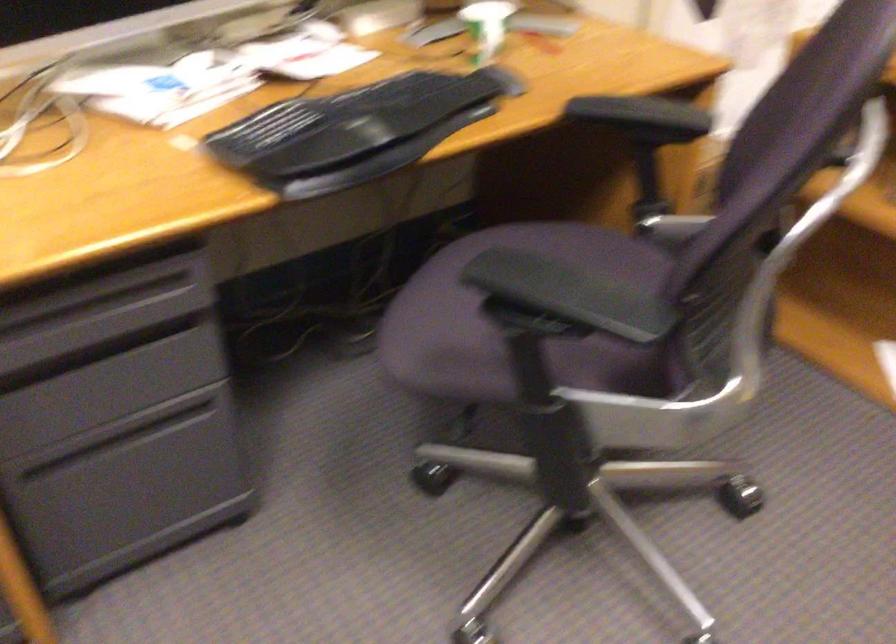
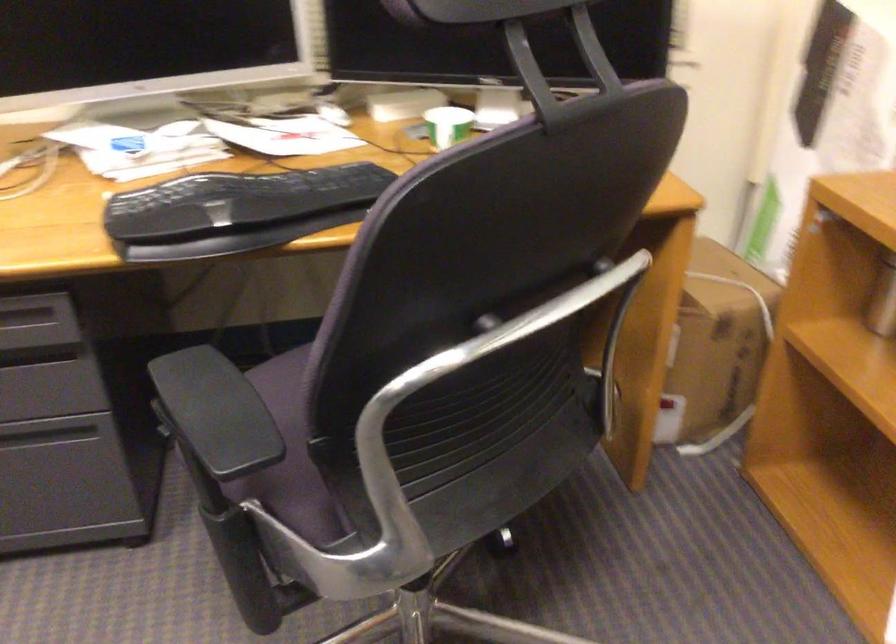
Question: The camera is either moving clockwise (left) or counter-clockwise (right) around the object. The first image is from the beginning of the video and the second image is from the end. Is the camera moving left or right when shooting the video?

Choices:
 (A) Left
 (B) Right

Answer: (B)